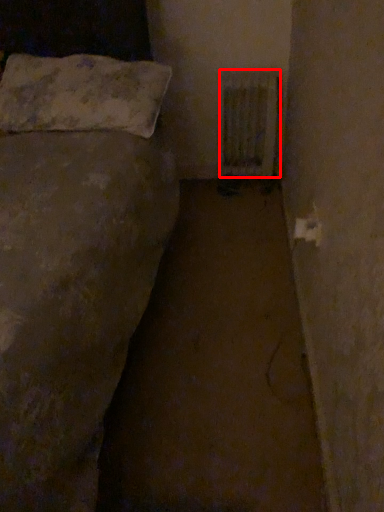
Question: Observing the image, what is the correct spatial positioning of radiator (annotated by the red box) in reference to pillow?

Choices:
 (A) left
 (B) right

Answer: (B)